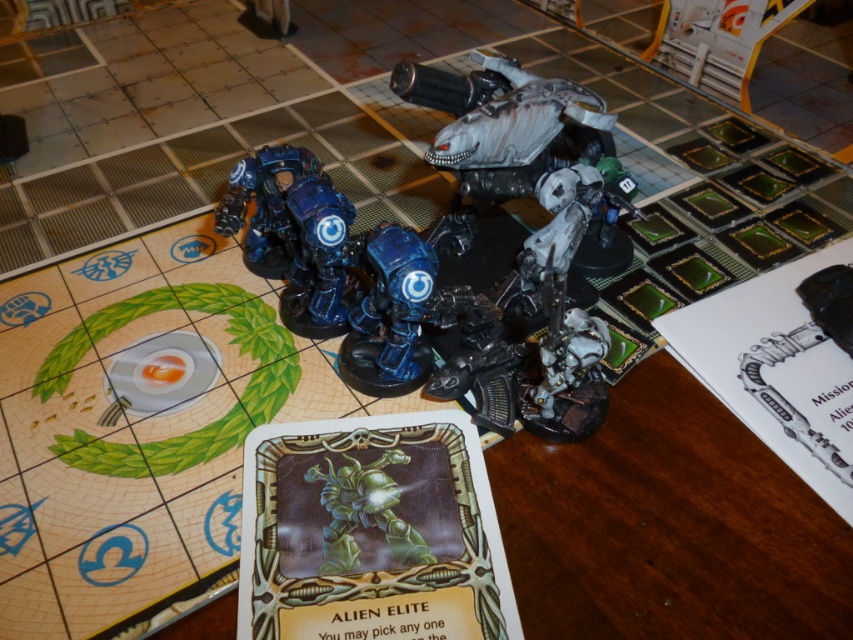
Is point (303, 300) positioned before point (410, 262)?

No, (303, 300) is further to viewer.

Which is below, blue metallic armor at center or blue metallic alien elite at center?

blue metallic alien elite at center is lower down.

Does point (233, 170) come in front of point (432, 285)?

No, (233, 170) is further to viewer.

Image resolution: width=853 pixels, height=640 pixels. Find the location of `blue metallic armor at center`. blue metallic armor at center is located at coordinates (294, 234).